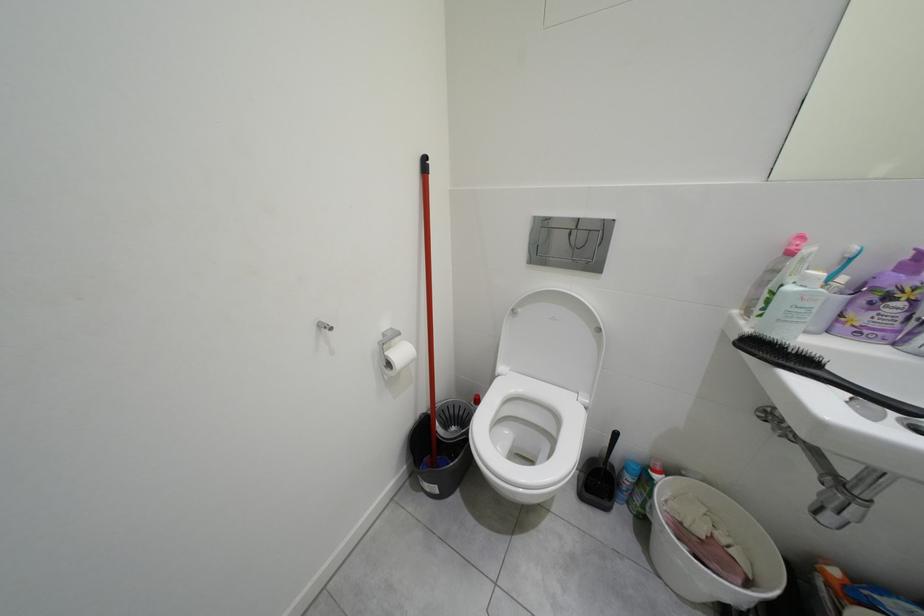
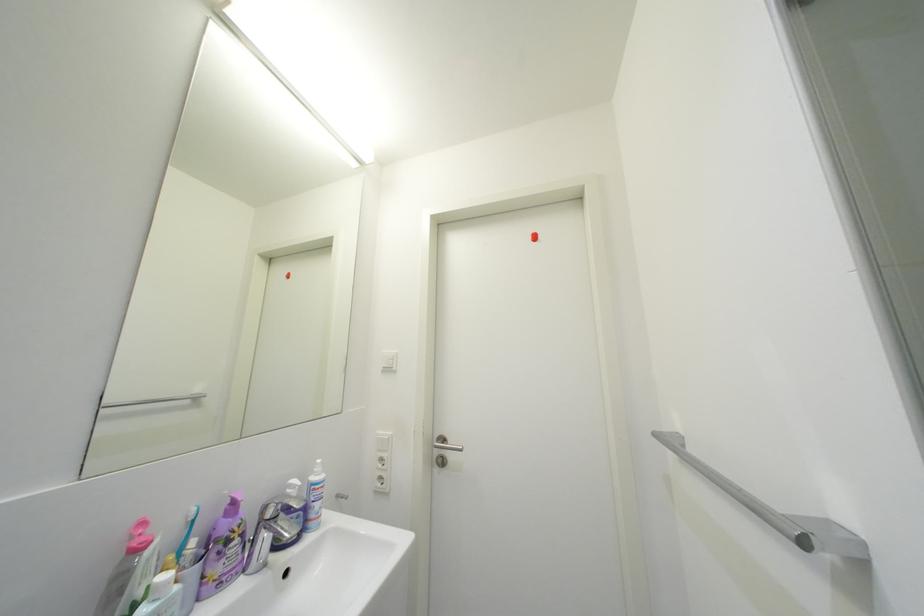
Question: The first image is from the beginning of the video and the second image is from the end. How did the camera likely rotate when shooting the video?

Choices:
 (A) Left
 (B) Right
 (C) Up
 (D) Down

Answer: (B)